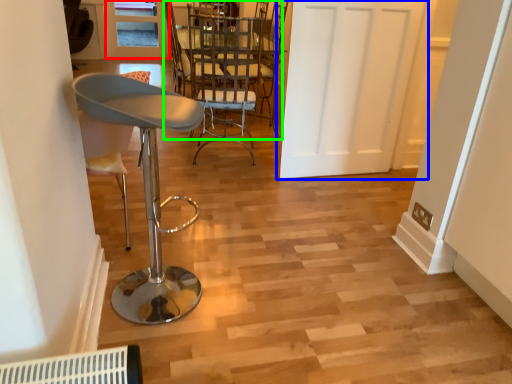
Question: Based on their relative distances, which object is farther from window (highlighted by a red box)? Choose from door (highlighted by a blue box) and chair (highlighted by a green box).

Choices:
 (A) door
 (B) chair

Answer: (A)